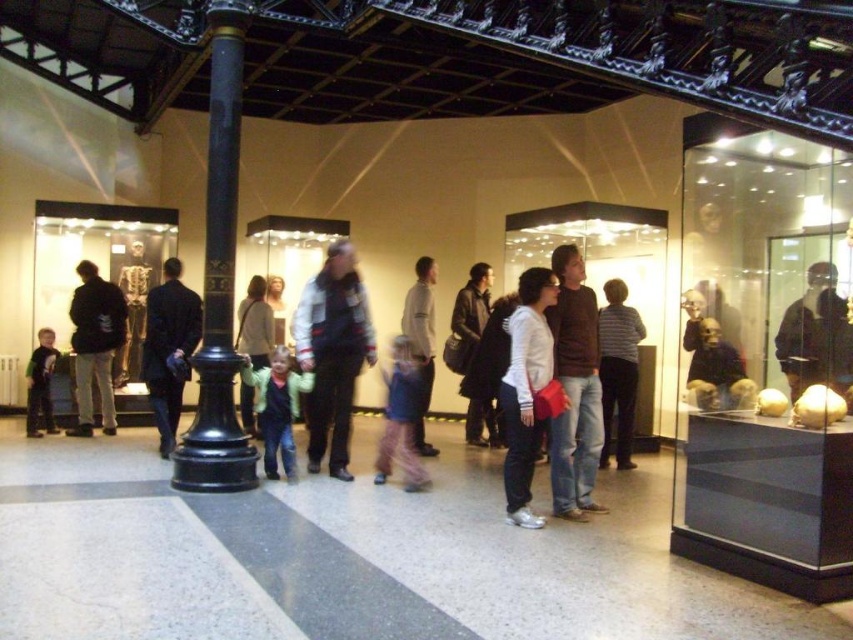
Question: Is striped sweater at center below light gray sweater at center?

Choices:
 (A) yes
 (B) no

Answer: (A)

Question: Does matte brown skull at center right have a larger size compared to gold metallic skeleton at center?

Choices:
 (A) no
 (B) yes

Answer: (B)

Question: Does white fleece jacket at center have a smaller size compared to matte brown jacket at center?

Choices:
 (A) no
 (B) yes

Answer: (A)

Question: Estimate the real-world distances between objects in this image. Which object is farther from the light brown leather jacket at center?

Choices:
 (A) white fleece jacket at center
 (B) shiny silver helmet at upper right
 (C) light green fleece jacket at center

Answer: (B)

Question: Which point appears farthest from the camera in this image?

Choices:
 (A) (405, 420)
 (B) (602, 416)

Answer: (B)

Question: Among these points, which one is farthest from the camera?

Choices:
 (A) (834, 387)
 (B) (399, 365)

Answer: (B)